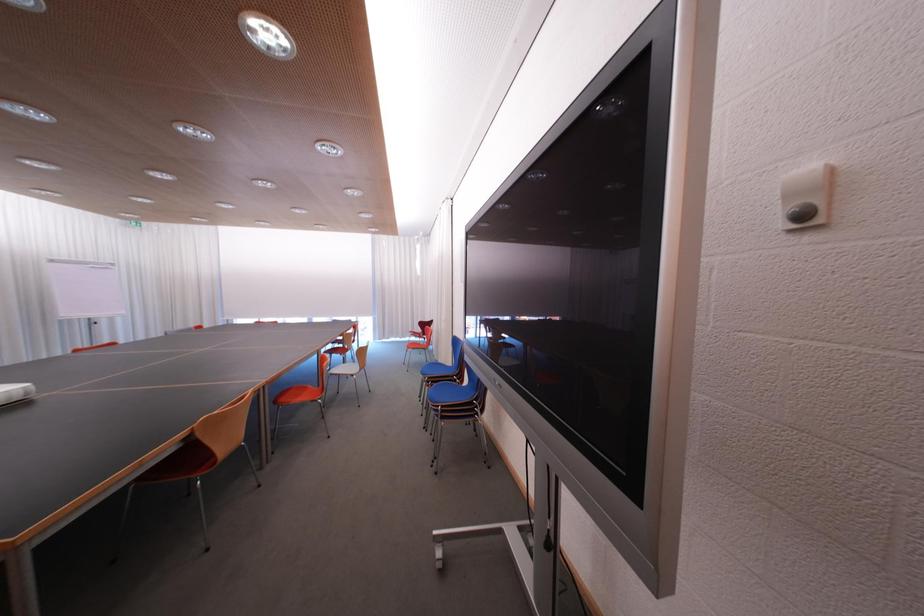
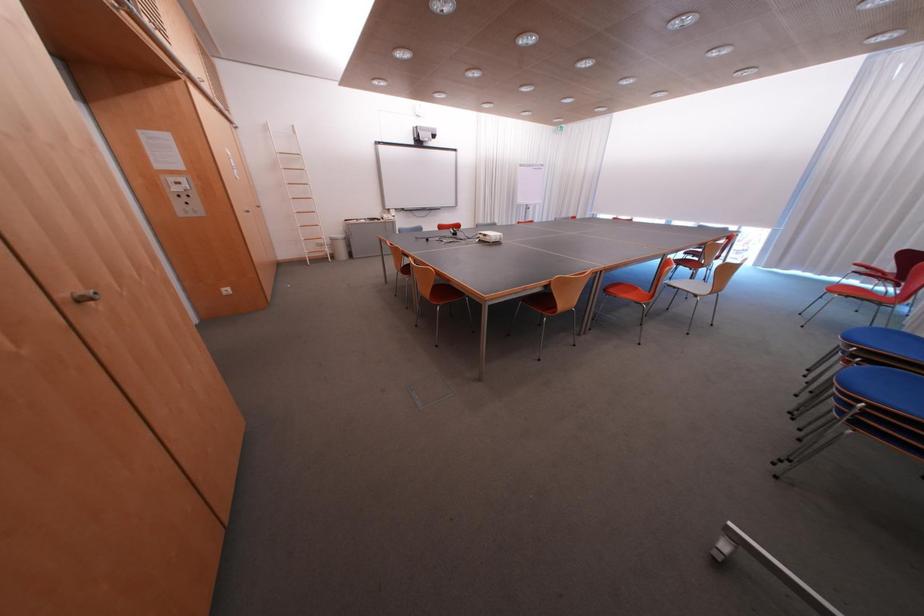
How did the camera likely rotate?

The camera rotated toward left-down.